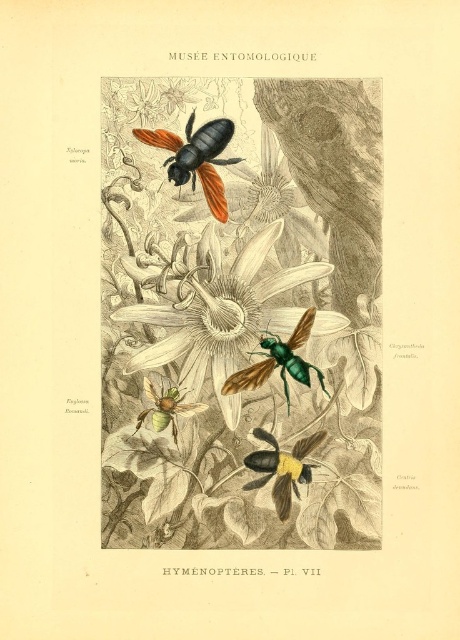
Based on the photo, you are an entomologist examining the MUS?E ENTOMOLOGIQUE illustration. You notice two points marked in the image. The first point is at coordinates point [214,284] and the second is at point [310,451]. Which point is closer to your viewpoint as you look at the illustration?

Point [214,284] is further to the camera than point .705, 0.674. Therefore, point [310,451] is closer to your viewpoint as you look at the illustration.

Based on the photo, you are an entomologist examining the illustration and need to identify which bee is positioned higher. The metallic green bee at center and the green matte bee at center are both present. Which one is taller?

The metallic green bee at center is taller than the green matte bee at center according to the illustration.